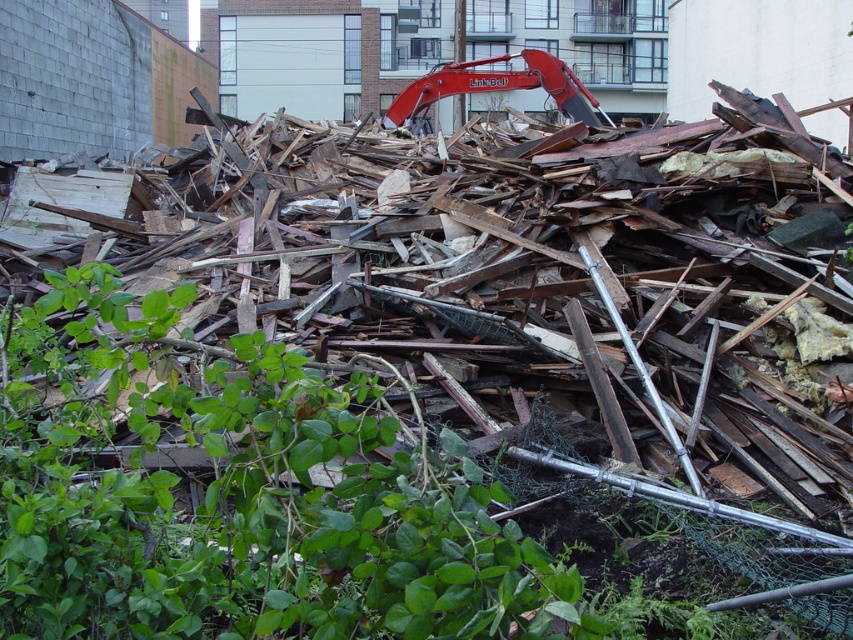
Question: Does green leafy plant at lower left appear on the left side of red metal excavator at upper center?

Choices:
 (A) no
 (B) yes

Answer: (B)

Question: Is green leafy plant at lower left closer to the viewer compared to red metal excavator at upper center?

Choices:
 (A) no
 (B) yes

Answer: (B)

Question: Which object appears closest to the camera in this image?

Choices:
 (A) green leafy plant at lower left
 (B) red metal excavator at upper center

Answer: (A)

Question: Can you confirm if green leafy plant at lower left is wider than red metal excavator at upper center?

Choices:
 (A) yes
 (B) no

Answer: (B)

Question: Which of the following is the farthest from the observer?

Choices:
 (A) (219, 604)
 (B) (523, 76)

Answer: (B)